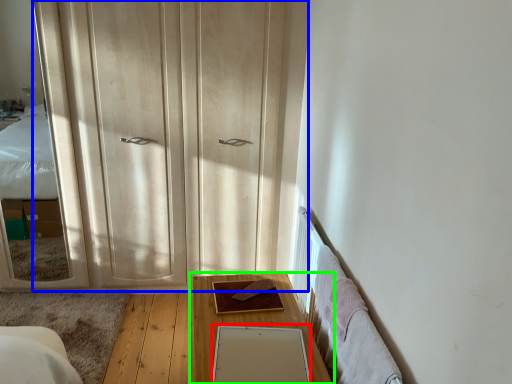
Question: Which is farther away from mirror (highlighted by a red box)? dresser (highlighted by a blue box) or table (highlighted by a green box)?

Choices:
 (A) dresser
 (B) table

Answer: (A)